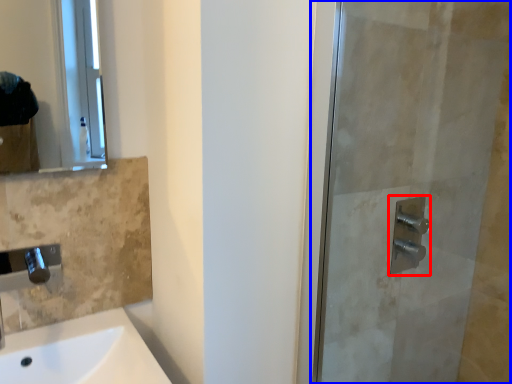
Question: Which object appears closest to the camera in this image, shower (highlighted by a red box) or screen door (highlighted by a blue box)?

Choices:
 (A) shower
 (B) screen door

Answer: (B)